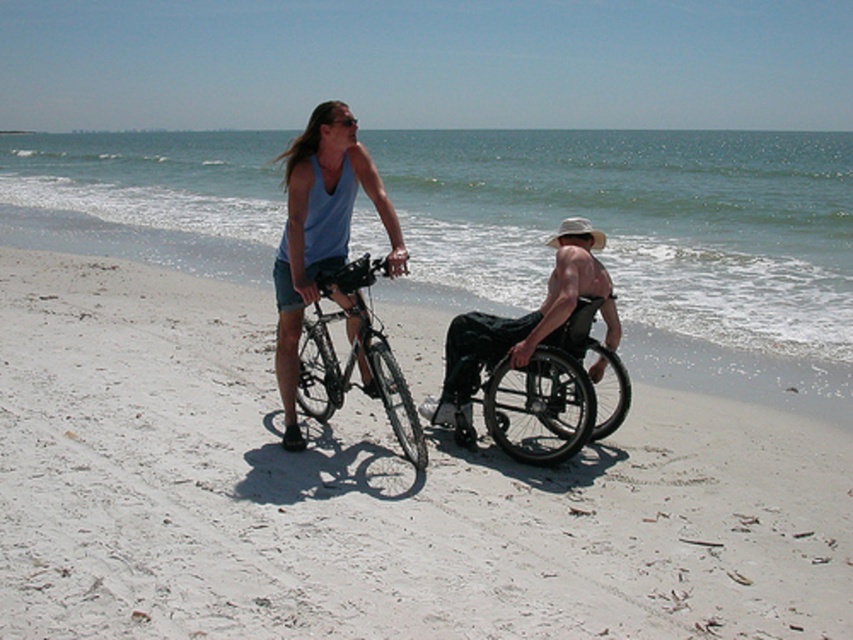
You are planning to take a photo of both the black plastic wheelchair at center and the silver metallic bicycle at center. Since you want both objects to be in the same frame, which object should you position closer to the camera to ensure they appear equally sized in the photo?

The black plastic wheelchair at center is to the right of the silver metallic bicycle at center. To make them appear equally sized in the photo, position the silver metallic bicycle at center closer to the camera since it is farther away from the camera than the black plastic wheelchair at center.

You are a photographer planning to take a photo of the beach scene. You need to ensure both the black matte wheelchair at center and the black plastic wheelchair at center are clearly visible. Which wheelchair should you focus on first if you want to capture them in order from left to right as they appear in the image?

The black matte wheelchair at center should be focused on first because it is positioned on the left side of the black plastic wheelchair at center.

You are planning to place a 36 inch wide picnic blanket between the black plastic wheelchair at center and the silver metallic bicycle at center. Based on their current positions, will there be enough space for the blanket?

The black plastic wheelchair at center is 33.51 inches away from the silver metallic bicycle at center. Since the distance between them is less than 36 inches, the picnic blanket will not fit between them.